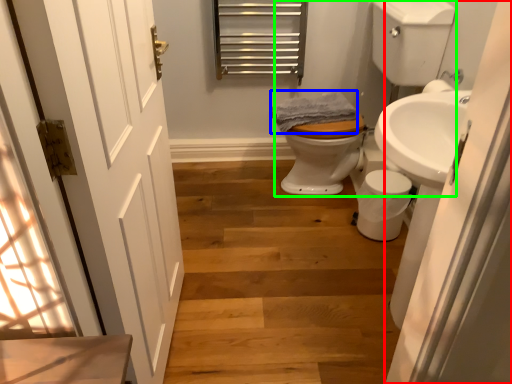
Question: Which is nearer to the screen door (highlighted by a red box)? bath towel (highlighted by a blue box) or landing (highlighted by a green box).

Choices:
 (A) bath towel
 (B) landing

Answer: (B)